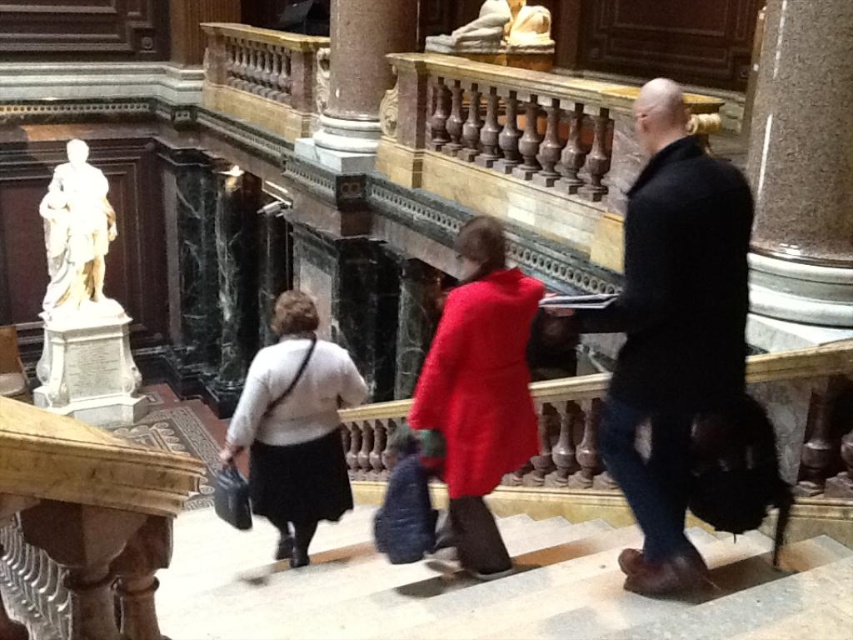
You are a visitor in this historical building and notice the dark brown leather coat at center and the white marble statue at left. Which object is smaller in size?

Result: The dark brown leather coat at center is smaller in size compared to the white marble statue at left.

You are standing at the base of the staircase in the grand interior. You see a velvet red coat at center and a white marble statue at left. Which object is closer to you?

The velvet red coat at center is closer to you because it is positioned under the white marble statue at left, indicating it is lower in elevation and thus nearer.